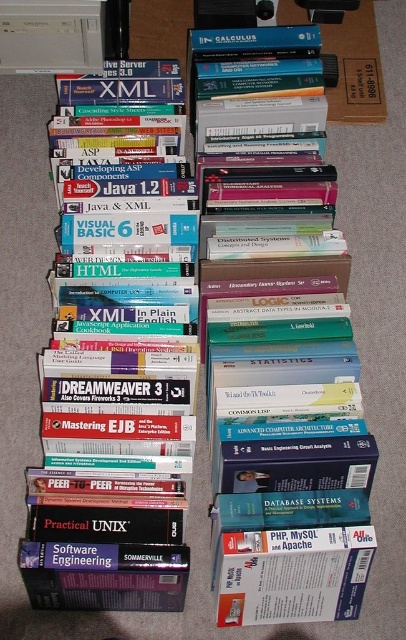
Is hardcover book at left shorter than matte white book at lower center?

In fact, hardcover book at left may be taller than matte white book at lower center.

How much distance is there between hardcover book at left and matte white book at lower center?

hardcover book at left is 11.94 inches from matte white book at lower center.

What do you see at coordinates (116, 404) in the screenshot?
I see `hardcover book at left` at bounding box center [116, 404].

Locate an element on the screen. This screenshot has height=640, width=406. hardcover book at left is located at coordinates (116, 404).

Between point (257, 464) and point (323, 618), which one is positioned behind?

Point (323, 618)

Looking at this image, is hardcover book at center to the right of matte white book at lower center from the viewer's perspective?

No, hardcover book at center is not to the right of matte white book at lower center.

You are a GUI agent. You are given a task and a screenshot of the screen. Output one action in this format:
    pyautogui.click(x=<x>, y=<y>)
    Task: Click on the hardcover book at center
    
    Given the screenshot: What is the action you would take?
    pyautogui.click(x=282, y=406)

You are a GUI agent. You are given a task and a screenshot of the screen. Output one action in this format:
    pyautogui.click(x=<x>, y=<y>)
    Task: Click on the hardcover book at center
    The width and height of the screenshot is (406, 640).
    Given the screenshot: What is the action you would take?
    pyautogui.click(x=282, y=406)

Does hardcover book at center appear on the left side of hardcover book at left?

Incorrect, hardcover book at center is not on the left side of hardcover book at left.

What do you see at coordinates (282, 406) in the screenshot? The image size is (406, 640). I see `hardcover book at center` at bounding box center [282, 406].

Image resolution: width=406 pixels, height=640 pixels. In order to click on hardcover book at center in this screenshot , I will do `click(282, 406)`.

At what (x,y) coordinates should I click in order to perform the action: click on hardcover book at center. Please return your answer as a coordinate pair (x, y). This screenshot has height=640, width=406. Looking at the image, I should click on (282, 406).